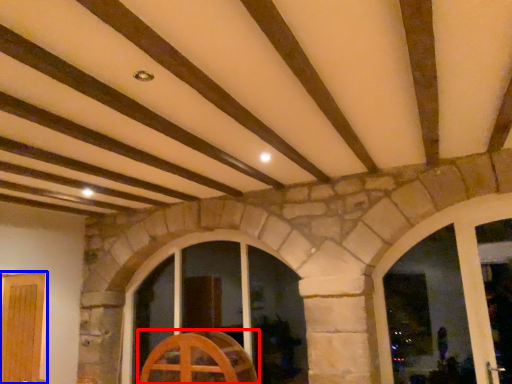
Question: Which of the following is the farthest to the observer, furniture (highlighted by a red box) or door (highlighted by a blue box)?

Choices:
 (A) furniture
 (B) door

Answer: (A)